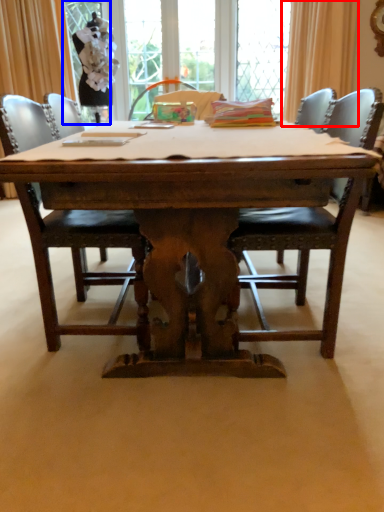
Question: Which object is further to the camera taking this photo, curtain (highlighted by a red box) or screen door (highlighted by a blue box)?

Choices:
 (A) curtain
 (B) screen door

Answer: (B)